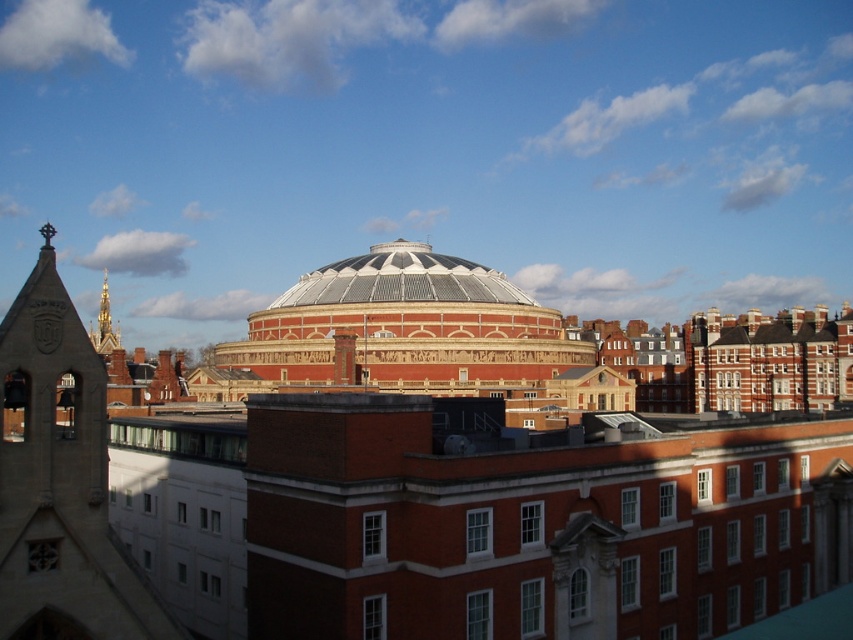
Can you confirm if white textured dome at center is bigger than goldmaterial/texturespire at upper left?

No.

Does white textured dome at center appear on the left side of goldmaterial/texturespire at upper left?

In fact, white textured dome at center is to the right of goldmaterial/texturespire at upper left.

Does point (288, 289) come closer to viewer compared to point (102, 291)?

That is False.

This screenshot has height=640, width=853. Find the location of `white textured dome at center`. white textured dome at center is located at coordinates (402, 280).

Between point (45, 225) and point (105, 278), which one is positioned in front?

Point (45, 225)

Is point (86, 529) farther from viewer compared to point (117, 336)?

No, it is not.

Find the location of a particular element. This screenshot has height=640, width=853. stone bell tower at left is located at coordinates (61, 481).

I want to click on stone bell tower at left, so click(x=61, y=481).

Is point (399, 243) more distant than point (103, 355)?

No, it is in front of (103, 355).

Who is more forward, (x=318, y=280) or (x=119, y=326)?

Point (x=318, y=280) is more forward.

Is point (410, 268) more distant than point (103, 340)?

No, (410, 268) is closer to viewer.

Locate an element on the screen. white textured dome at center is located at coordinates (402, 280).